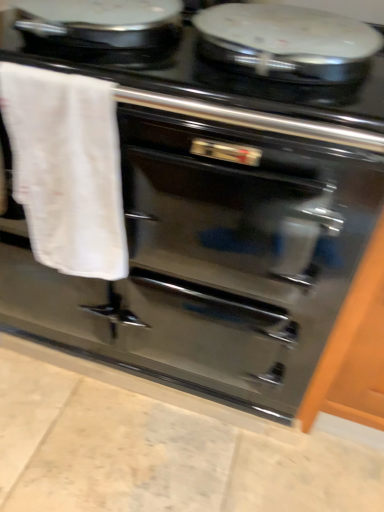
This screenshot has width=384, height=512. What do you see at coordinates (354, 350) in the screenshot?
I see `glossy wood cabinet at right` at bounding box center [354, 350].

Where is `white cotton towel at left`? The image size is (384, 512). white cotton towel at left is located at coordinates (67, 169).

Where is `black glossy stove at upper center`? This screenshot has width=384, height=512. black glossy stove at upper center is located at coordinates (214, 77).

Between white cotton towel at left and black glossy stove at upper center, which one has more height?

white cotton towel at left.

Which object is wider, white cotton towel at left or black glossy stove at upper center?

black glossy stove at upper center is wider.

Looking at this image, are white cotton towel at left and black glossy stove at upper center beside each other?

No, white cotton towel at left is not touching black glossy stove at upper center.

Does point (23, 163) appear closer or farther from the camera than point (270, 110)?

Point (23, 163) is positioned farther from the camera compared to point (270, 110).

Is black glossy stove at upper center not inside white cotton towel at left?

Absolutely, black glossy stove at upper center is external to white cotton towel at left.

Is black glossy stove at upper center looking in the opposite direction of white cotton towel at left?

That's not correct — black glossy stove at upper center is not looking away from white cotton towel at left.

From a real-world perspective, between black glossy stove at upper center and white cotton towel at left, who is vertically higher?

black glossy stove at upper center is physically above.

Measure the distance from black glossy stove at upper center to white cotton towel at left.

They are 8.47 inches apart.

Considering the positions of objects glossy wood cabinet at right and white cotton towel at left in the image provided, who is in front, glossy wood cabinet at right or white cotton towel at left?

white cotton towel at left is closer to the camera.

From a real-world perspective, is glossy wood cabinet at right over white cotton towel at left?

Actually, glossy wood cabinet at right is physically below white cotton towel at left in the real world.

Can you tell me how much glossy wood cabinet at right and white cotton towel at left differ in facing direction?

They differ by 0.403 degrees in their facing directions.

Considering the sizes of glossy wood cabinet at right and white cotton towel at left in the image, is glossy wood cabinet at right taller or shorter than white cotton towel at left?

Clearly, glossy wood cabinet at right is taller compared to white cotton towel at left.

Considering the sizes of objects black glossy stove at upper center and glossy wood cabinet at right in the image provided, who is taller, black glossy stove at upper center or glossy wood cabinet at right?

With more height is glossy wood cabinet at right.

Is black glossy stove at upper center not within glossy wood cabinet at right?

Yes.

From a real-world perspective, which is physically below, black glossy stove at upper center or glossy wood cabinet at right?

glossy wood cabinet at right is physically lower.

Looking at this image, is white cotton towel at left directly adjacent to glossy wood cabinet at right?

No, white cotton towel at left is not in contact with glossy wood cabinet at right.

From a real-world perspective, is white cotton towel at left over glossy wood cabinet at right?

Correct, in the physical world, white cotton towel at left is higher than glossy wood cabinet at right.

Considering the points (83, 177) and (383, 280), which point is behind, point (83, 177) or point (383, 280)?

Positioned behind is point (383, 280).

Locate an element on the screen. The image size is (384, 512). bath towel in front of the glossy wood cabinet at right is located at coordinates (67, 169).

Could you tell me if glossy wood cabinet at right is turned towards black glossy stove at upper center?

No, glossy wood cabinet at right does not turn towards black glossy stove at upper center.

Considering the points (302, 424) and (198, 73), which point is behind, point (302, 424) or point (198, 73)?

The point (302, 424) is farther.

From a real-world perspective, relative to black glossy stove at upper center, is glossy wood cabinet at right vertically above or below?

glossy wood cabinet at right is situated lower than black glossy stove at upper center in the real world.

Consider the image. How many degrees apart are the facing directions of glossy wood cabinet at right and black glossy stove at upper center?

There is a 0.443-degree angle between the facing directions of glossy wood cabinet at right and black glossy stove at upper center.

The image size is (384, 512). What are the coordinates of `bath towel below the black glossy stove at upper center (from a real-world perspective)` in the screenshot? It's located at (67, 169).

I want to click on bath towel that appears in front of the black glossy stove at upper center, so click(x=67, y=169).

Based on their spatial positions, is glossy wood cabinet at right or black glossy stove at upper center closer to white cotton towel at left?

black glossy stove at upper center is closer to white cotton towel at left.

Estimate the real-world distances between objects in this image. Which object is further from black glossy stove at upper center, glossy wood cabinet at right or white cotton towel at left?

Among the two, glossy wood cabinet at right is located further to black glossy stove at upper center.

From the picture: Considering their positions, is white cotton towel at left positioned further to glossy wood cabinet at right than black glossy stove at upper center?

white cotton towel at left lies further to glossy wood cabinet at right than the other object.

Which object lies nearer to the anchor point white cotton towel at left, black glossy stove at upper center or glossy wood cabinet at right?

black glossy stove at upper center is closer to white cotton towel at left.

From the image, which object appears to be nearer to black glossy stove at upper center, white cotton towel at left or glossy wood cabinet at right?

Based on the image, white cotton towel at left appears to be nearer to black glossy stove at upper center.

Looking at the image, which one is located further to glossy wood cabinet at right, black glossy stove at upper center or white cotton towel at left?

white cotton towel at left is further to glossy wood cabinet at right.

You are a GUI agent. You are given a task and a screenshot of the screen. Output one action in this format:
    pyautogui.click(x=<x>, y=<y>)
    Task: Click on the gas stove located between white cotton towel at left and glossy wood cabinet at right in the left-right direction
    The image size is (384, 512).
    Given the screenshot: What is the action you would take?
    pyautogui.click(x=214, y=77)